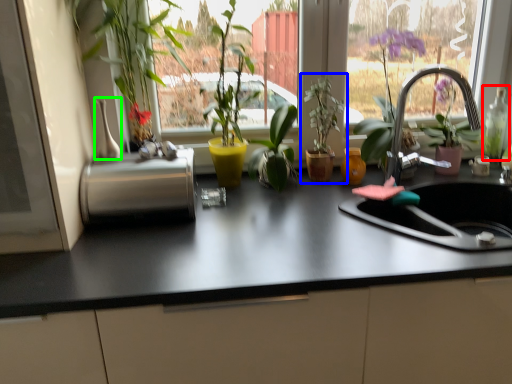
Question: Considering the real-world distances, which object is closest to bottle (highlighted by a red box)? houseplant (highlighted by a blue box) or vase (highlighted by a green box).

Choices:
 (A) houseplant
 (B) vase

Answer: (A)